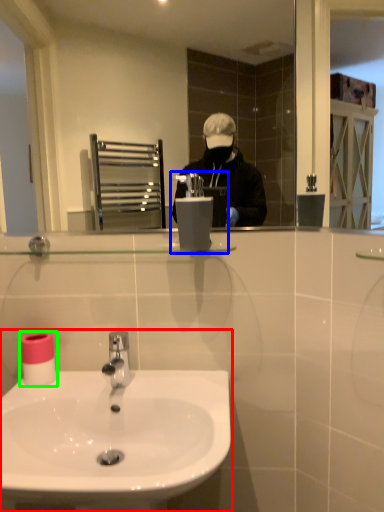
Question: Estimate the real-world distances between objects in this image. Which object is closer to sink (highlighted by a red box), hand dryer (highlighted by a blue box) or toilet paper (highlighted by a green box)?

Choices:
 (A) hand dryer
 (B) toilet paper

Answer: (B)